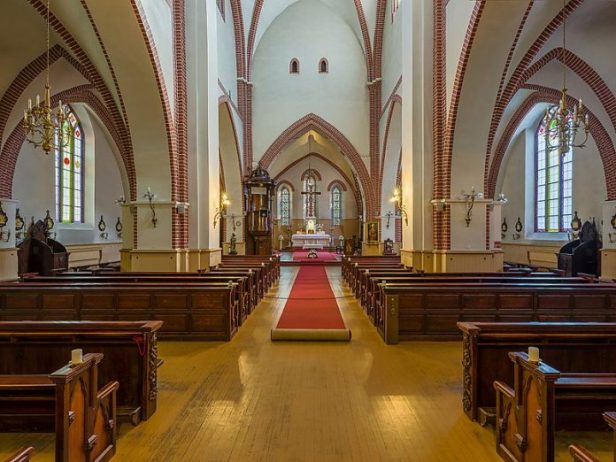
Where is `seats`? seats is located at coordinates (493, 359).